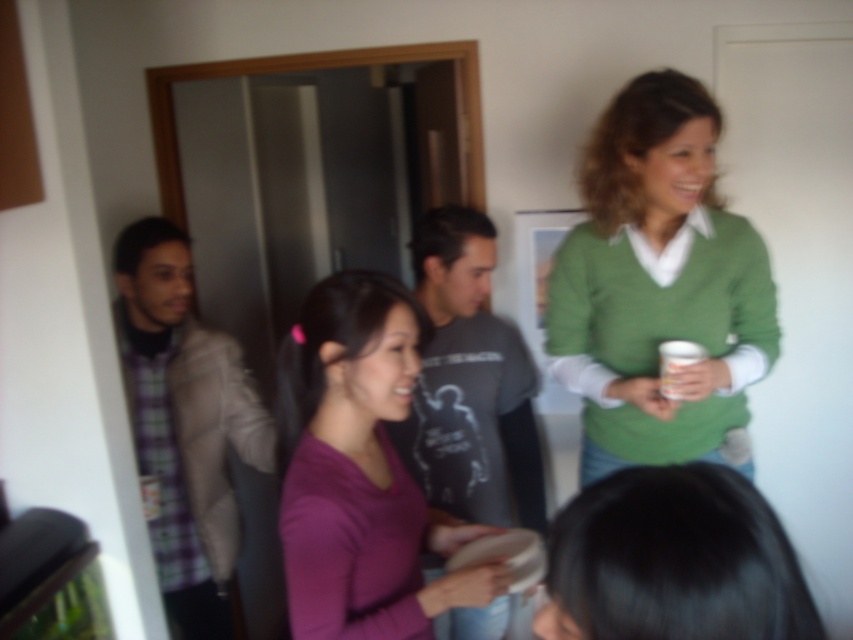
Is black hair at lower center shorter than white paper cup at upper right?

In fact, black hair at lower center may be taller than white paper cup at upper right.

Does black hair at lower center have a lesser width compared to white paper cup at upper right?

Incorrect, black hair at lower center's width is not less than white paper cup at upper right's.

Between point (752, 497) and point (679, 362), which one is positioned behind?

The point (679, 362) is more distant.

Locate an element on the screen. black hair at lower center is located at coordinates (672, 561).

Who is lower down, green matte sweater at upper right or plaid fabric shirt at left?

Positioned lower is plaid fabric shirt at left.

Image resolution: width=853 pixels, height=640 pixels. What do you see at coordinates (659, 285) in the screenshot?
I see `green matte sweater at upper right` at bounding box center [659, 285].

What do you see at coordinates (659, 285) in the screenshot?
I see `green matte sweater at upper right` at bounding box center [659, 285].

The width and height of the screenshot is (853, 640). I want to click on green matte sweater at upper right, so click(x=659, y=285).

Between green matte sweater at upper right and white paper cup at upper right, which one has less height?

white paper cup at upper right is shorter.

At what (x,y) coordinates should I click in order to perform the action: click on green matte sweater at upper right. Please return your answer as a coordinate pair (x, y). The height and width of the screenshot is (640, 853). Looking at the image, I should click on (659, 285).